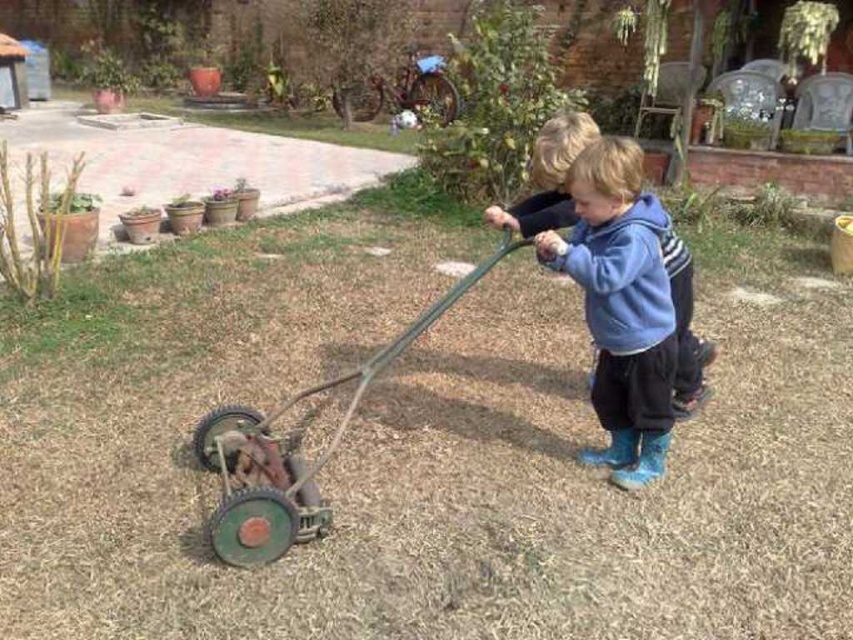
Question: Does rusty metal wagon at lower left have a greater width compared to blue fleece hoodie at center?

Choices:
 (A) yes
 (B) no

Answer: (A)

Question: Is rusty metal wagon at lower left positioned at the back of blue fleece hoodie at center?

Choices:
 (A) yes
 (B) no

Answer: (B)

Question: Is rusty metal wagon at lower left wider than blue fleece hoodie at center?

Choices:
 (A) yes
 (B) no

Answer: (A)

Question: Which object is farther from the camera taking this photo?

Choices:
 (A) rusty metal wagon at lower left
 (B) blue fleece hoodie at center

Answer: (B)